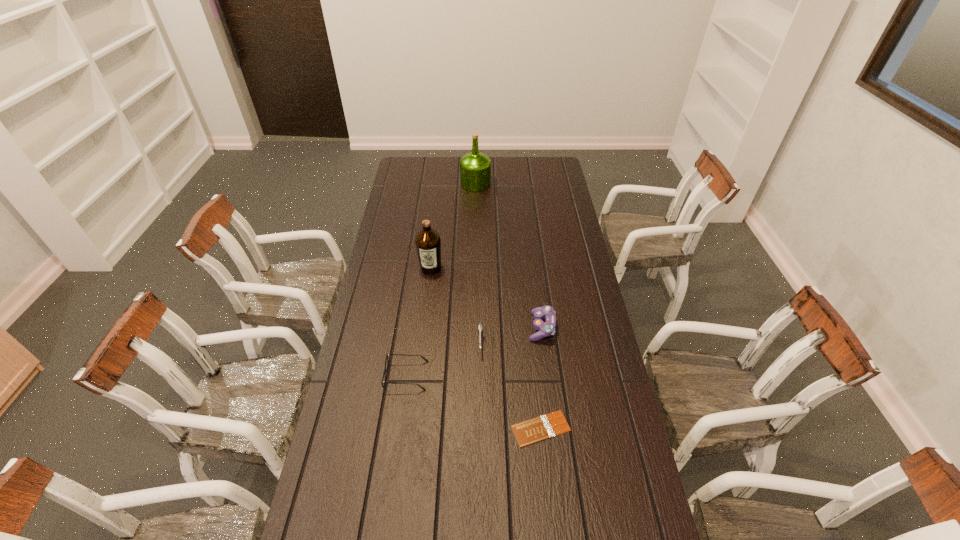
Where is `vacant space situated 0.360m on the front of the farthest object`? The height and width of the screenshot is (540, 960). vacant space situated 0.360m on the front of the farthest object is located at coordinates (475, 236).

Find the location of a particular element. This screenshot has height=540, width=960. vacant space located 0.250m on the label of the nearer olive oil is located at coordinates (424, 323).

Where is `vacant space positioned on the left of the control`? vacant space positioned on the left of the control is located at coordinates (500, 327).

Locate an element on the screen. The height and width of the screenshot is (540, 960). vacant space located 0.190m on the front-facing side of the third shortest object is located at coordinates (480, 407).

The height and width of the screenshot is (540, 960). What are the coordinates of `free space located with the lenses facing outward on the second shortest object` in the screenshot? It's located at (547, 376).

You are a GUI agent. You are given a task and a screenshot of the screen. Output one action in this format:
    pyautogui.click(x=<x>, y=<y>)
    Task: Click on the vacant space situated on the left of the chocolate bar
    
    Given the screenshot: What is the action you would take?
    pyautogui.click(x=425, y=428)

The width and height of the screenshot is (960, 540). In order to click on object that is positioned at the far edge in this screenshot , I will do `click(475, 167)`.

Find the location of `object at the left edge`. object at the left edge is located at coordinates (384, 372).

Where is `free region at the far edge of the desktop`? The width and height of the screenshot is (960, 540). free region at the far edge of the desktop is located at coordinates (493, 170).

The image size is (960, 540). I want to click on vacant area at the left edge, so click(x=414, y=210).